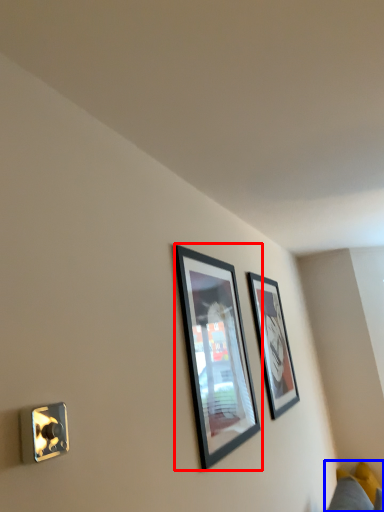
Question: Among these objects, which one is farthest to the camera, picture frame (highlighted by a red box) or couch (highlighted by a blue box)?

Choices:
 (A) picture frame
 (B) couch

Answer: (B)